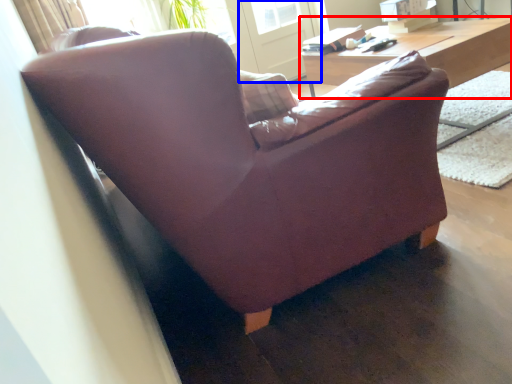
Question: Which object is further to the camera taking this photo, table (highlighted by a red box) or screen door (highlighted by a blue box)?

Choices:
 (A) table
 (B) screen door

Answer: (B)